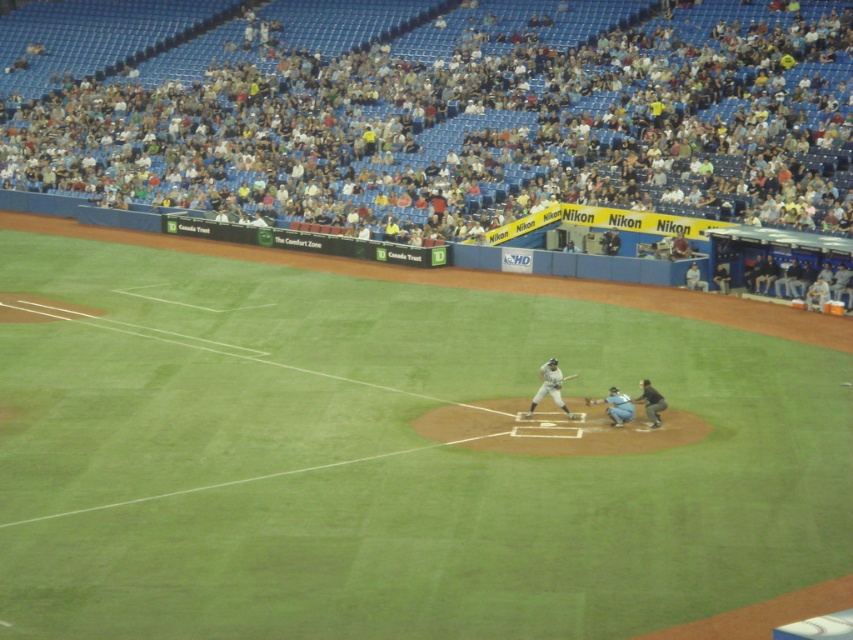
Question: Does gray uniformed man at center have a greater width compared to wooden baseball bat at center?

Choices:
 (A) yes
 (B) no

Answer: (A)

Question: Considering the real-world distances, which object is closest to the gray uniformed man at center?

Choices:
 (A) brown leather glove at home plate
 (B) green grass field at center

Answer: (B)

Question: Can you confirm if dark gray uniform at home plate is positioned to the left of wooden bat at home plate?

Choices:
 (A) yes
 (B) no

Answer: (B)

Question: Is dark gray uniform at home plate closer to camera compared to wooden bat at home plate?

Choices:
 (A) yes
 (B) no

Answer: (A)

Question: Which object is farther from the camera taking this photo?

Choices:
 (A) wooden baseball bat at center
 (B) blue fabric catcher at center
 (C) green grass field at center
 (D) brown leather glove at home plate

Answer: (D)

Question: Among these objects, which one is farthest from the camera?

Choices:
 (A) green grass field at center
 (B) brown leather glove at home plate
 (C) dark gray uniform at home plate
 (D) wooden baseball bat at center

Answer: (B)